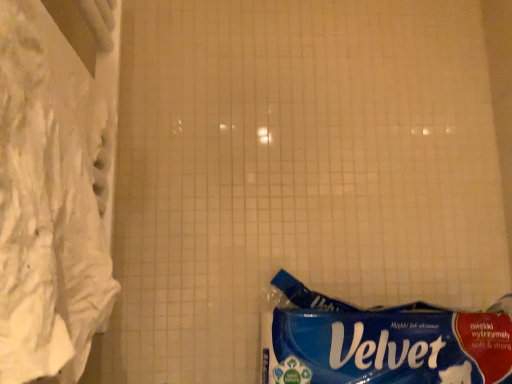
Where is `white fabric curtain at left`? The image size is (512, 384). white fabric curtain at left is located at coordinates (55, 184).

Describe the element at coordinates (55, 184) in the screenshot. I see `white fabric curtain at left` at that location.

Where is `blue paper towel at lower right`? blue paper towel at lower right is located at coordinates (382, 342).

Measure the distance between blue paper towel at lower right and camera.

blue paper towel at lower right is 27.25 inches from camera.

What do you see at coordinates (382, 342) in the screenshot? Image resolution: width=512 pixels, height=384 pixels. I see `blue paper towel at lower right` at bounding box center [382, 342].

Identify the location of white fabric curtain at left. (55, 184).

Is white fabric curtain at left at the left side of blue paper towel at lower right?

Indeed, white fabric curtain at left is positioned on the left side of blue paper towel at lower right.

Considering their positions, is white fabric curtain at left located in front of or behind blue paper towel at lower right?

In the image, white fabric curtain at left appears in front of blue paper towel at lower right.

Which is nearer, (77,365) or (468,382)?

The point (77,365) is in front.

From the image's perspective, is white fabric curtain at left located above or below blue paper towel at lower right?

From the image's perspective, white fabric curtain at left appears above blue paper towel at lower right.

From a real-world perspective, which is physically below, white fabric curtain at left or blue paper towel at lower right?

blue paper towel at lower right.

Does white fabric curtain at left have a lesser width compared to blue paper towel at lower right?

Correct, the width of white fabric curtain at left is less than that of blue paper towel at lower right.

From the picture: Between white fabric curtain at left and blue paper towel at lower right, which one has more height?

white fabric curtain at left.

Between white fabric curtain at left and blue paper towel at lower right, which one has smaller size?

Smaller between the two is white fabric curtain at left.

Can we say white fabric curtain at left lies outside blue paper towel at lower right?

Yes, white fabric curtain at left is not within blue paper towel at lower right.

Is white fabric curtain at left next to blue paper towel at lower right and touching it?

No, white fabric curtain at left is not next to blue paper towel at lower right.

Based on the photo, is white fabric curtain at left facing away from blue paper towel at lower right?

white fabric curtain at left is not turned away from blue paper towel at lower right.

How different are the orientations of white fabric curtain at left and blue paper towel at lower right in degrees?

The facing directions of white fabric curtain at left and blue paper towel at lower right are 90.6 degrees apart.

Where is `curtain lying in front of the blue paper towel at lower right`? The width and height of the screenshot is (512, 384). curtain lying in front of the blue paper towel at lower right is located at coordinates (55, 184).

In the scene shown: Would you say blue paper towel at lower right is to the left or to the right of white fabric curtain at left in the picture?

Based on their positions, blue paper towel at lower right is located to the right of white fabric curtain at left.

Relative to white fabric curtain at left, is blue paper towel at lower right in front or behind?

blue paper towel at lower right is behind white fabric curtain at left.

Considering the positions of point (301, 314) and point (86, 277), is point (301, 314) closer or farther from the camera than point (86, 277)?

Clearly, point (301, 314) is more distant from the camera than point (86, 277).

From the image's perspective, is blue paper towel at lower right over white fabric curtain at left?

No.

From a real-world perspective, is blue paper towel at lower right positioned above or below white fabric curtain at left?

From a real-world perspective, blue paper towel at lower right is physically below white fabric curtain at left.

Looking at their sizes, would you say blue paper towel at lower right is wider or thinner than white fabric curtain at left?

Clearly, blue paper towel at lower right has more width compared to white fabric curtain at left.

Who is shorter, blue paper towel at lower right or white fabric curtain at left?

With less height is blue paper towel at lower right.

Is blue paper towel at lower right bigger or smaller than white fabric curtain at left?

Clearly, blue paper towel at lower right is larger in size than white fabric curtain at left.

Choose the correct answer: Is blue paper towel at lower right inside white fabric curtain at left or outside it?

blue paper towel at lower right lies outside white fabric curtain at left.

Is blue paper towel at lower right placed right next to white fabric curtain at left?

No.

Could you tell me if blue paper towel at lower right is turned towards white fabric curtain at left?

No, blue paper towel at lower right is not turned towards white fabric curtain at left.

What's the angular difference between blue paper towel at lower right and white fabric curtain at left's facing directions?

90.6 degrees.

How much distance is there between blue paper towel at lower right and white fabric curtain at left?

18.49 inches.

At what (x,y) coordinates should I click in order to perform the action: click on curtain that is above the blue paper towel at lower right (from the image's perspective). Please return your answer as a coordinate pair (x, y). The image size is (512, 384). Looking at the image, I should click on (55, 184).

Identify the location of curtain on the left of blue paper towel at lower right. This screenshot has width=512, height=384. (55, 184).

This screenshot has width=512, height=384. I want to click on waste below the white fabric curtain at left (from the image's perspective), so click(382, 342).